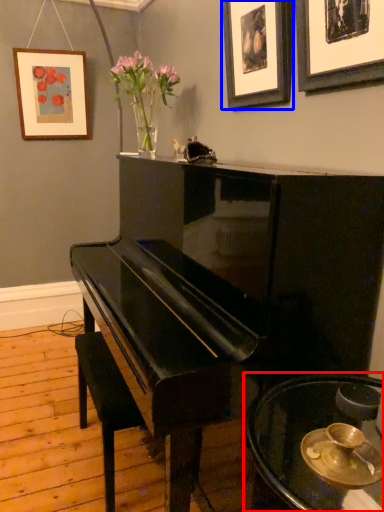
Question: Which point is closer to the camera, table (highlighted by a red box) or picture frame (highlighted by a blue box)?

Choices:
 (A) table
 (B) picture frame

Answer: (A)